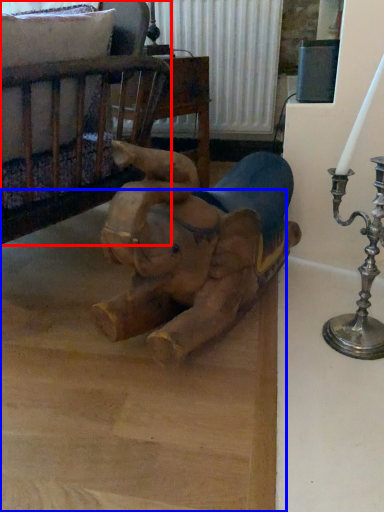
Question: Which of the following is the farthest to the observer, furniture (highlighted by a red box) or cardboard (highlighted by a blue box)?

Choices:
 (A) furniture
 (B) cardboard

Answer: (A)